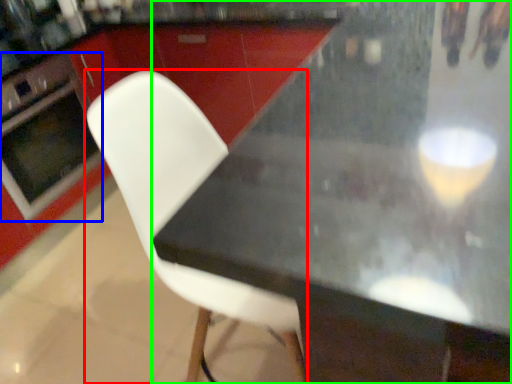
Question: Which object is positioned closest to chair (highlighted by a red box)? Select from oven (highlighted by a blue box) and table (highlighted by a green box).

Choices:
 (A) oven
 (B) table

Answer: (B)